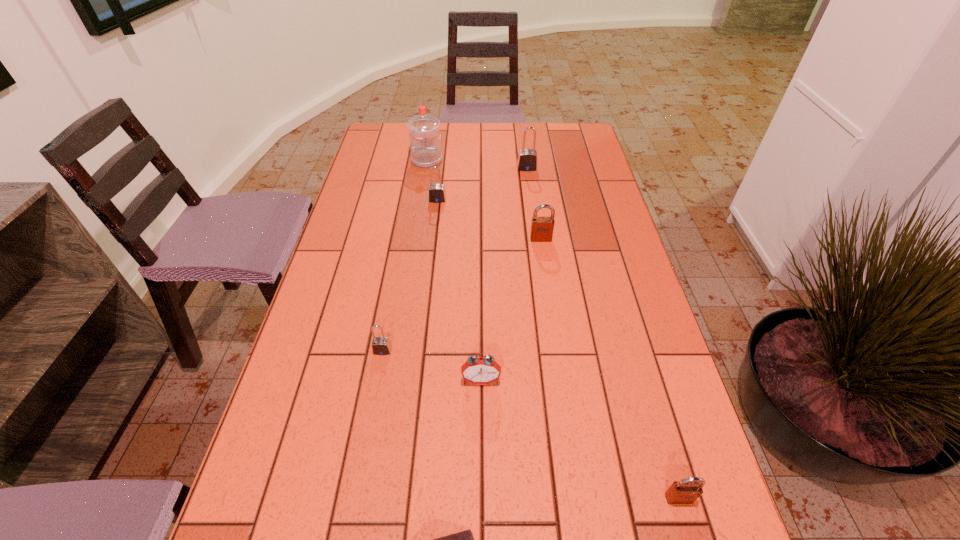
You are a GUI agent. You are given a task and a screenshot of the screen. Output one action in this format:
    pyautogui.click(x=<x>, y=<y>)
    Task: Click on the leftmost padlock
    The image size is (960, 540).
    Given the screenshot: What is the action you would take?
    pyautogui.click(x=380, y=345)

At what (x,y) coordinates should I click in order to perform the action: click on the nearer brown padlock. Please return your answer as a coordinate pair (x, y). The width and height of the screenshot is (960, 540). Looking at the image, I should click on (686, 491).

At what (x,y) coordinates should I click in order to perform the action: click on the rightmost object. Please return your answer as a coordinate pair (x, y). This screenshot has width=960, height=540. Looking at the image, I should click on (686, 491).

The width and height of the screenshot is (960, 540). I want to click on vacant region located on the handle side of the tallest object, so click(x=421, y=195).

Identify the location of vacant region located on the shackle of the farthest gray padlock. The height and width of the screenshot is (540, 960). (529, 184).

What are the coordinates of `free space located 0.290m on the shackle of the second padlock from left to right` in the screenshot? It's located at (429, 269).

I want to click on free space located on the front-facing side of the fifth nearest object, so click(554, 327).

Locate an element on the screen. Image resolution: width=960 pixels, height=540 pixels. free space located on the clock face of the sixth farthest object is located at coordinates (481, 495).

Where is `free space located on the shackle of the leftmost padlock`? This screenshot has width=960, height=540. free space located on the shackle of the leftmost padlock is located at coordinates (354, 507).

Locate an element on the screen. This screenshot has width=960, height=540. vacant position located 0.050m on the front-facing side of the rightmost padlock is located at coordinates (690, 537).